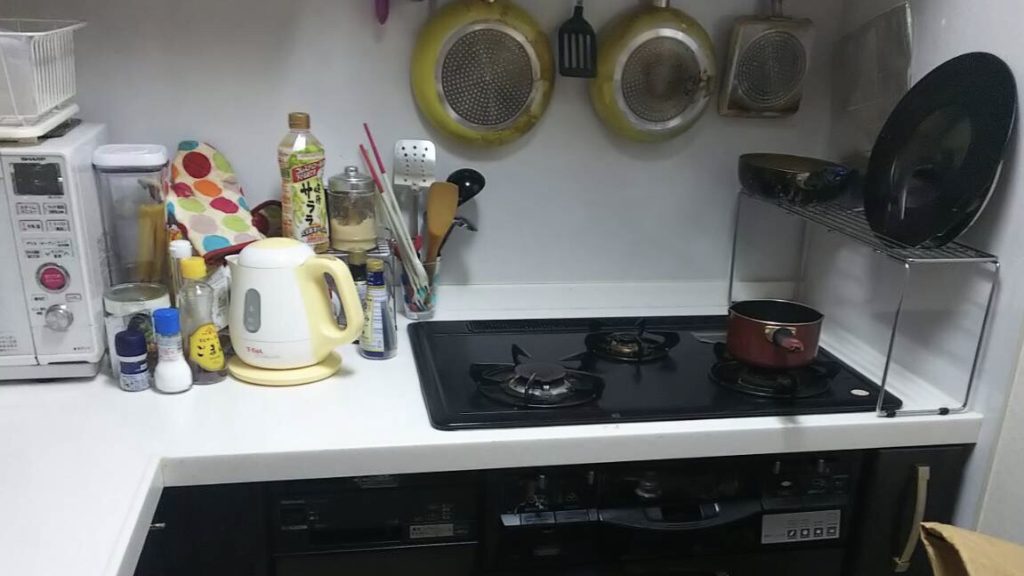
Where is `tea kettle`? tea kettle is located at coordinates (x=293, y=323).